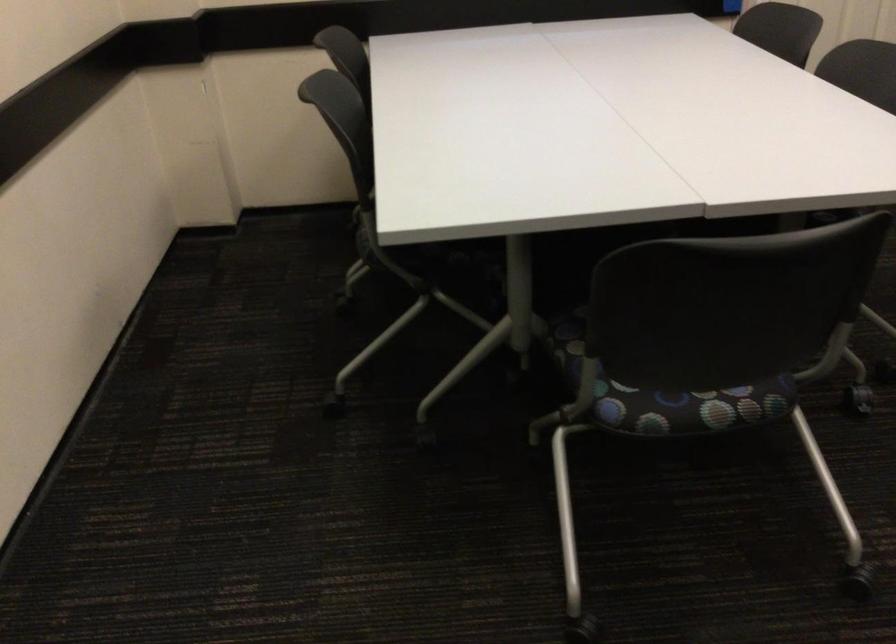
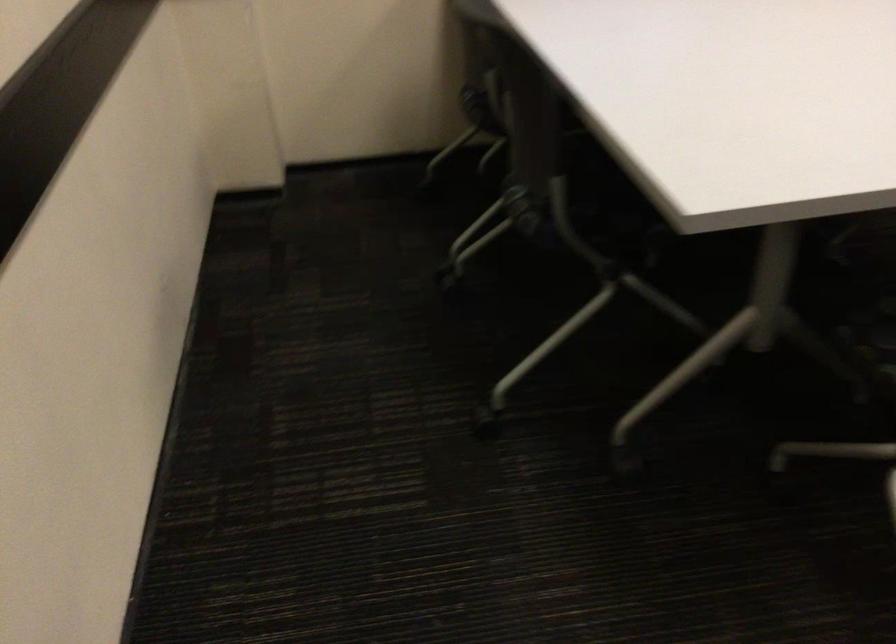
Find the pixel in the second image that matches point 433,252 in the first image.

(619, 227)